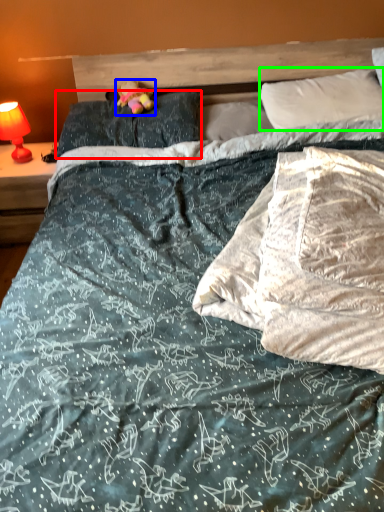
Question: Which is farther away from pillow (highlighted by a red box)? figurine (highlighted by a blue box) or pillow (highlighted by a green box)?

Choices:
 (A) figurine
 (B) pillow

Answer: (B)